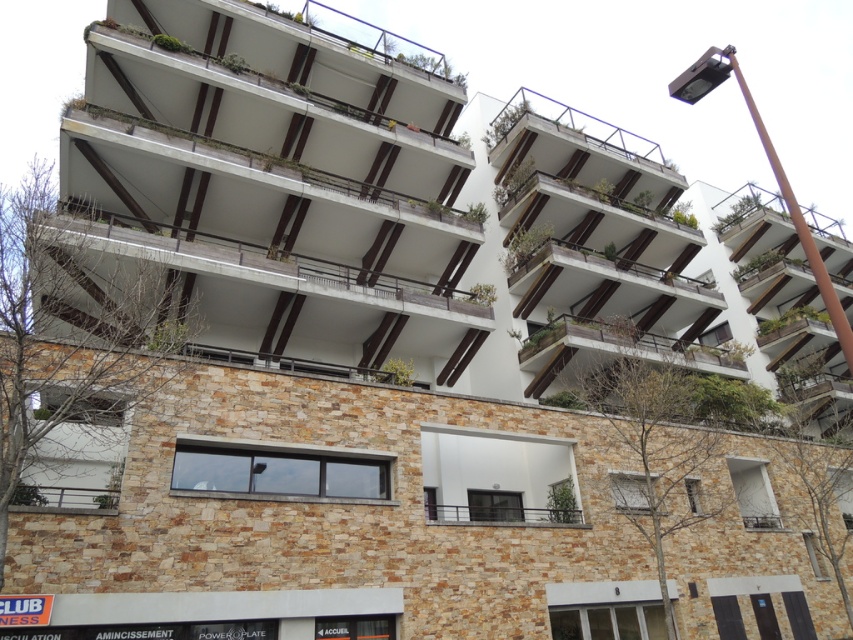
Describe the element at coordinates (608, 349) in the screenshot. This screenshot has height=640, width=853. I see `white wooden balcony at center` at that location.

Between white wooden balcony at center and green wooden balcony at upper center, which one is positioned lower?

Positioned lower is white wooden balcony at center.

You are a GUI agent. You are given a task and a screenshot of the screen. Output one action in this format:
    pyautogui.click(x=<x>, y=<y>)
    Task: Click on the white wooden balcony at center
    This screenshot has width=853, height=640.
    Given the screenshot: What is the action you would take?
    [x=608, y=349]

Is brown stone balcony at center thinner than green wooden balcony at upper center?

No, brown stone balcony at center is not thinner than green wooden balcony at upper center.

Does brown stone balcony at center appear on the right side of green wooden balcony at upper center?

Yes, brown stone balcony at center is to the right of green wooden balcony at upper center.

This screenshot has width=853, height=640. What do you see at coordinates (339, 195) in the screenshot?
I see `brown stone balcony at center` at bounding box center [339, 195].

Image resolution: width=853 pixels, height=640 pixels. Find the location of `brown stone balcony at center`. brown stone balcony at center is located at coordinates (339, 195).

Is concrete at center to the right of white wooden balcony at center from the viewer's perspective?

Incorrect, concrete at center is not on the right side of white wooden balcony at center.

Is concrete at center bigger than white wooden balcony at center?

Correct, concrete at center is larger in size than white wooden balcony at center.

Which is behind, point (459, 304) or point (686, 364)?

The point (686, 364) is more distant.

I want to click on concrete at center, so click(277, 264).